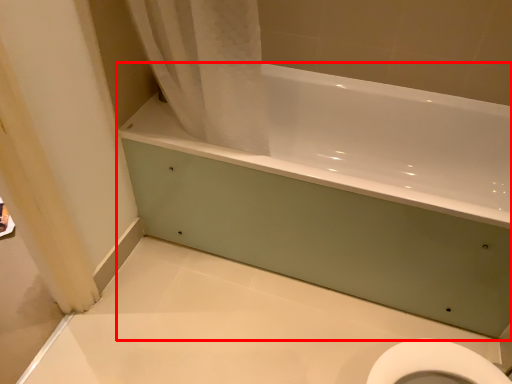
Question: Considering the relative positions of bathtub (annotated by the red box) and shower curtain in the image provided, where is bathtub (annotated by the red box) located with respect to the staircase?

Choices:
 (A) right
 (B) left

Answer: (A)